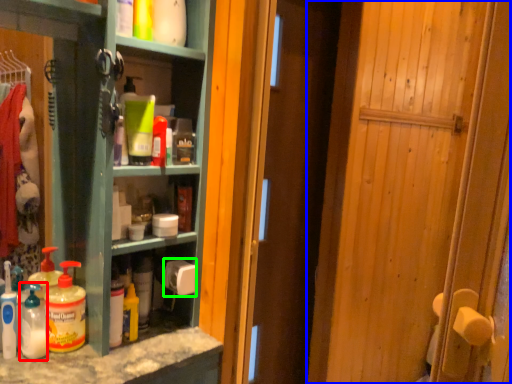
Question: Estimate the real-world distances between objects in this image. Which object is closer to cleaning product (highlighted by a red box), door (highlighted by a blue box) or toilet paper (highlighted by a green box)?

Choices:
 (A) door
 (B) toilet paper

Answer: (B)